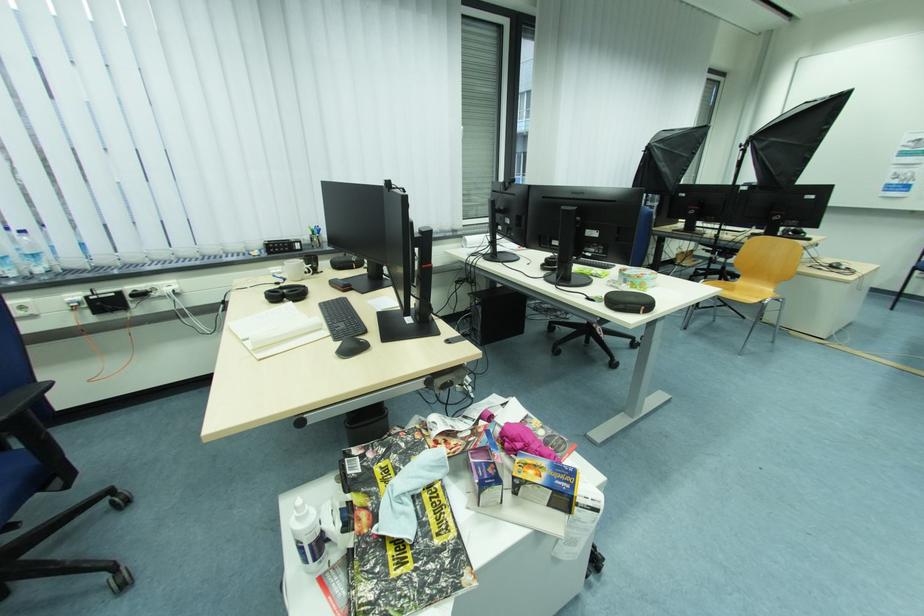
The location [637,277] corresponds to which object?

It refers to a round food container.